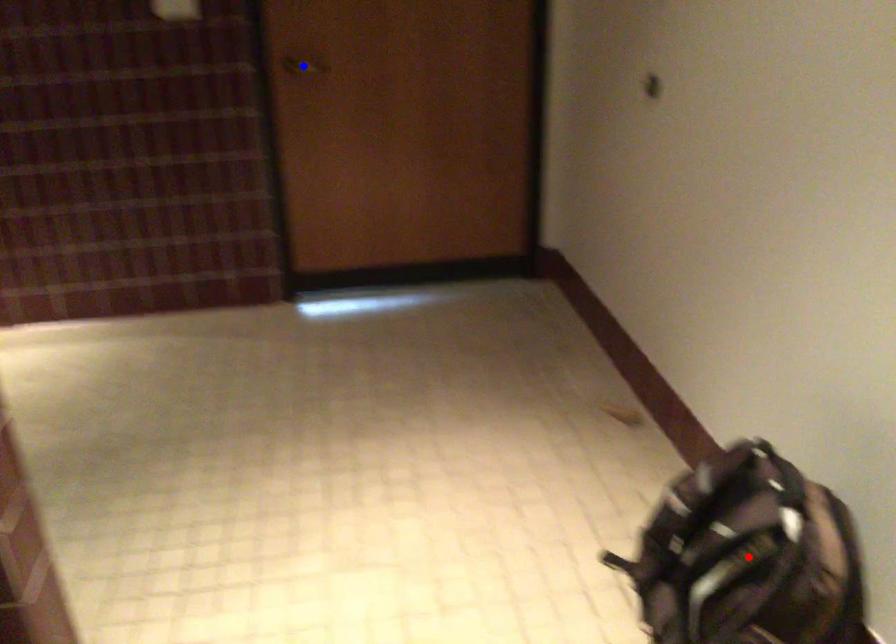
Question: Which of the two points in the image is closer to the camera?

Choices:
 (A) Blue point is closer.
 (B) Red point is closer.

Answer: (B)